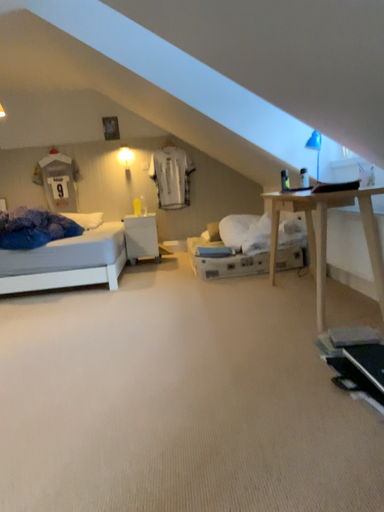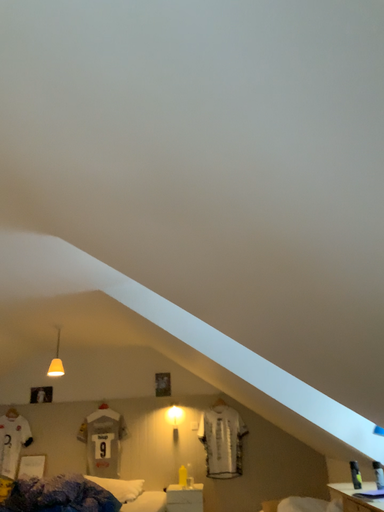
Question: How did the camera likely rotate when shooting the video?

Choices:
 (A) rotated upward
 (B) rotated downward

Answer: (A)